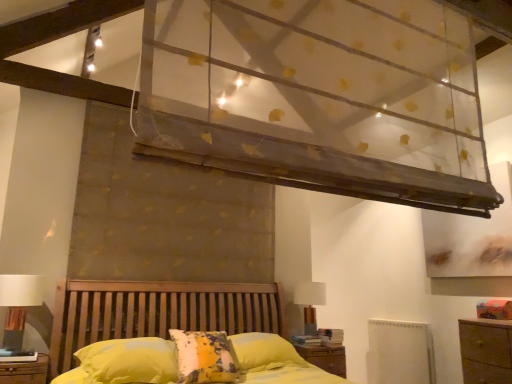
Question: Should I look upward or downward to see white fabric lampshade at upper right, the 2th table lamp from the front?

Choices:
 (A) down
 (B) up

Answer: (A)

Question: Can you confirm if transparent fabric canopy at upper center is shorter than white fabric lampshade at upper right, positioned as the first table lamp in back-to-front order?

Choices:
 (A) no
 (B) yes

Answer: (A)

Question: From a real-world perspective, is transparent fabric canopy at upper center over white fabric lampshade at upper right, the 2th table lamp from the front?

Choices:
 (A) yes
 (B) no

Answer: (A)

Question: Does transparent fabric canopy at upper center appear on the right side of white fabric lampshade at upper right, marked as the 1th table lamp in a right-to-left arrangement?

Choices:
 (A) yes
 (B) no

Answer: (B)

Question: Is transparent fabric canopy at upper center not near white fabric lampshade at upper right, positioned as the first table lamp in back-to-front order?

Choices:
 (A) no
 (B) yes

Answer: (B)

Question: From a real-world perspective, is transparent fabric canopy at upper center located beneath white fabric lampshade at upper right, marked as the 1th table lamp in a right-to-left arrangement?

Choices:
 (A) no
 (B) yes

Answer: (A)

Question: Can you confirm if transparent fabric canopy at upper center is taller than white fabric lampshade at upper right, marked as the 1th table lamp in a right-to-left arrangement?

Choices:
 (A) no
 (B) yes

Answer: (B)

Question: Is transparent fabric canopy at upper center facing away from wooden nightstand at lower center?

Choices:
 (A) no
 (B) yes

Answer: (A)

Question: Is transparent fabric canopy at upper center oriented towards wooden nightstand at lower center?

Choices:
 (A) no
 (B) yes

Answer: (A)

Question: Can you see transparent fabric canopy at upper center touching wooden nightstand at lower center?

Choices:
 (A) yes
 (B) no

Answer: (B)

Question: Considering the relative positions of transparent fabric canopy at upper center and wooden nightstand at lower center in the image provided, is transparent fabric canopy at upper center in front of wooden nightstand at lower center?

Choices:
 (A) yes
 (B) no

Answer: (A)

Question: Are transparent fabric canopy at upper center and wooden nightstand at lower center located far from each other?

Choices:
 (A) no
 (B) yes

Answer: (B)

Question: From the image's perspective, is transparent fabric canopy at upper center over wooden nightstand at lower center?

Choices:
 (A) yes
 (B) no

Answer: (A)

Question: From the image's perspective, is transparent fabric canopy at upper center located above white fabric lampshade at left, acting as the 2th table lamp starting from the right?

Choices:
 (A) no
 (B) yes

Answer: (B)